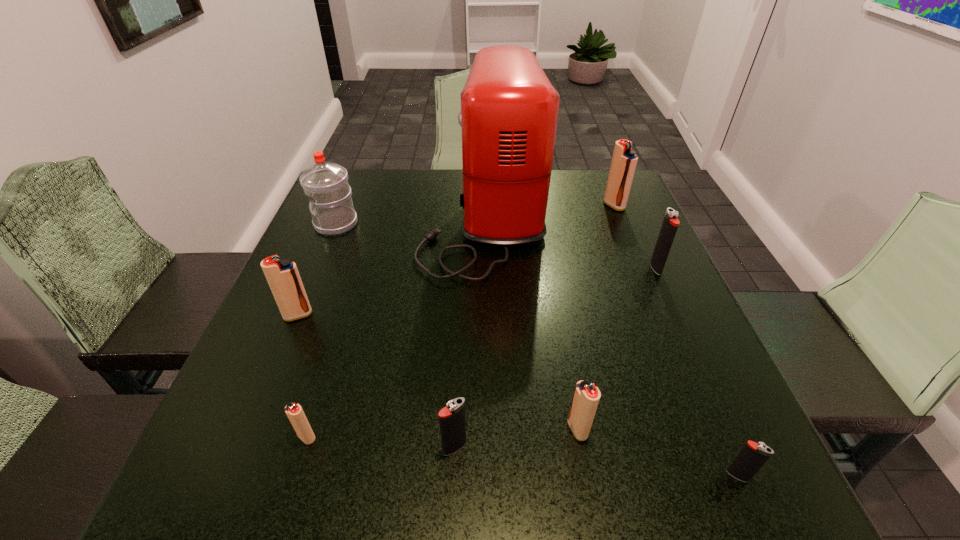
The image size is (960, 540). What are the coordinates of `the tallest object` in the screenshot? It's located at (509, 109).

The height and width of the screenshot is (540, 960). I want to click on kitchen mixer, so click(509, 109).

Identify the location of white water bottle. The height and width of the screenshot is (540, 960). (326, 184).

Where is `the rightmost red igniter`? The image size is (960, 540). the rightmost red igniter is located at coordinates (624, 161).

Find the location of `the farthest igniter`. the farthest igniter is located at coordinates [x=624, y=161].

What are the coordinates of `the third farthest igniter` in the screenshot? It's located at (283, 277).

This screenshot has height=540, width=960. Identify the location of the fifth farthest object. (283, 277).

Locate an element on the screen. The image size is (960, 540). the farthest black igniter is located at coordinates (670, 224).

This screenshot has width=960, height=540. I want to click on the sixth nearest igniter, so click(670, 224).

At what (x,y) coordinates should I click in order to perform the action: click on the leftmost black igniter. Please return your answer as a coordinate pair (x, y). This screenshot has width=960, height=540. Looking at the image, I should click on (452, 421).